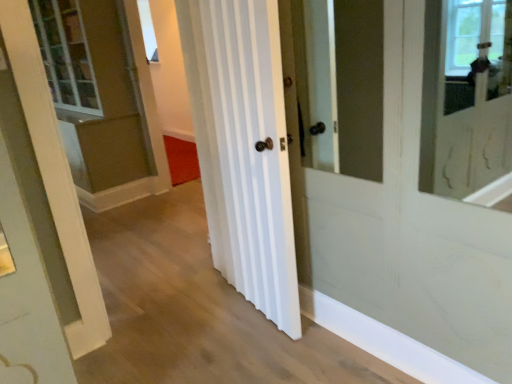
Question: Is white striped door at center closer to the viewer compared to clear glass window at upper center?

Choices:
 (A) yes
 (B) no

Answer: (A)

Question: Is white striped door at center directly adjacent to clear glass window at upper center?

Choices:
 (A) no
 (B) yes

Answer: (A)

Question: Considering the relative positions of white striped door at center and clear glass window at upper center in the image provided, is white striped door at center to the left of clear glass window at upper center from the viewer's perspective?

Choices:
 (A) yes
 (B) no

Answer: (B)

Question: Considering the relative sizes of white striped door at center and clear glass window at upper center in the image provided, is white striped door at center shorter than clear glass window at upper center?

Choices:
 (A) yes
 (B) no

Answer: (B)

Question: Is white striped door at center at the right side of clear glass window at upper center?

Choices:
 (A) no
 (B) yes

Answer: (B)

Question: Can you confirm if white striped door at center is taller than clear glass window at upper center?

Choices:
 (A) yes
 (B) no

Answer: (A)

Question: Is white striped door at center inside clear glass window at upper center?

Choices:
 (A) yes
 (B) no

Answer: (B)

Question: Does clear glass window at upper center appear on the left side of white striped door at center?

Choices:
 (A) no
 (B) yes

Answer: (B)

Question: From a real-world perspective, is clear glass window at upper center beneath white striped door at center?

Choices:
 (A) yes
 (B) no

Answer: (B)

Question: Is the depth of clear glass window at upper center greater than that of white striped door at center?

Choices:
 (A) no
 (B) yes

Answer: (B)

Question: Does clear glass window at upper center come in front of white striped door at center?

Choices:
 (A) yes
 (B) no

Answer: (B)

Question: From a real-world perspective, is clear glass window at upper center on top of white striped door at center?

Choices:
 (A) no
 (B) yes

Answer: (B)

Question: Based on their sizes in the image, would you say clear glass window at upper center is bigger or smaller than white striped door at center?

Choices:
 (A) small
 (B) big

Answer: (A)